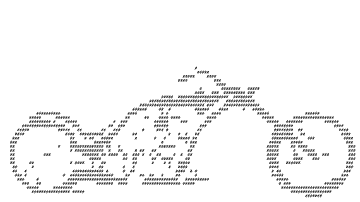
The image size is (360, 202). What are the coordinates of `grey framing` in the screenshot? It's located at (66, 188).